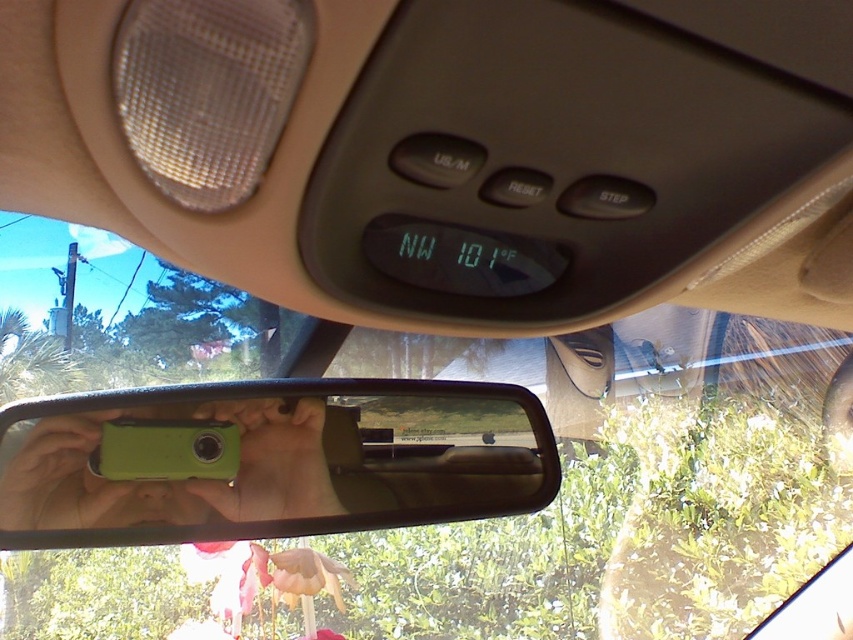
Consider the image. You are a passenger in the car and see both the green plastic phone at center and the green matte phone at center in the rearview mirror reflection. Which phone is positioned more to the right side of the reflection?

The green plastic phone at center is positioned more to the right side of the reflection than the green matte phone at center.

You are a passenger in the car and want to take a photo of the green plastic phone at center using your smartphone. Where should you aim your camera to capture it?

You should aim your camera at the point where the green plastic phone at center is located, which is at coordinates approximately 0.720 on the x axis and 0.315 on the y axis.

You are a driver who wants to check the temperature displayed on the dashboard. You see the green plastic phone at center and the green matte phone at center on the dashboard. Which phone should you look past to see the temperature display?

The green plastic phone at center is wider than the green matte phone at center, so you should look past the green plastic phone at center to see the temperature display.